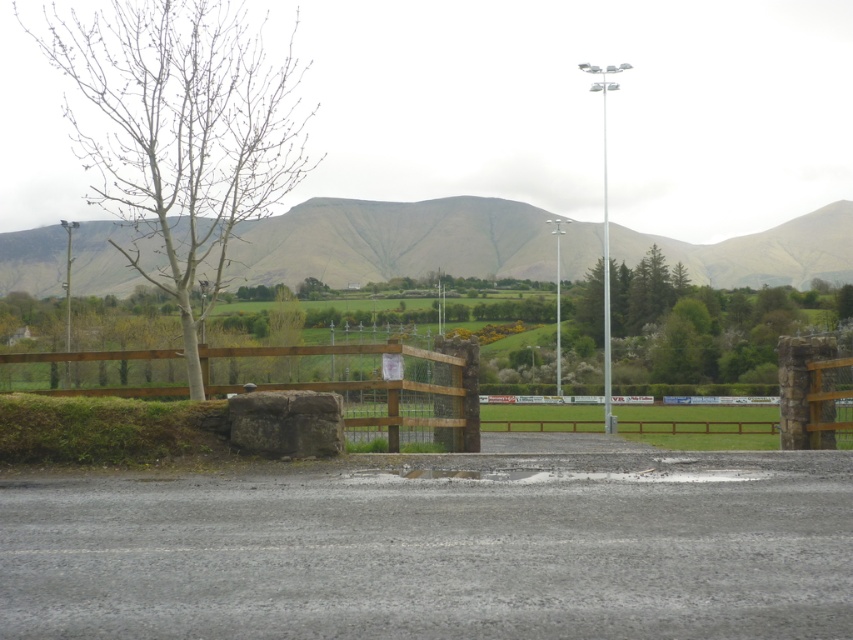
Between bare wood tree at left and green grassy hill at upper center, which one is positioned lower?

Positioned lower is green grassy hill at upper center.

Does bare wood tree at left have a larger size compared to green grassy hill at upper center?

No.

I want to click on bare wood tree at left, so click(178, 134).

Find the location of a particular element. bare wood tree at left is located at coordinates (178, 134).

Is green grassy hill at upper center further to camera compared to brown wooden fence at lower left?

Yes, it is behind brown wooden fence at lower left.

Locate an element on the screen. This screenshot has width=853, height=640. green grassy hill at upper center is located at coordinates (393, 241).

This screenshot has height=640, width=853. Describe the element at coordinates (393, 241) in the screenshot. I see `green grassy hill at upper center` at that location.

Where is `green grassy hill at upper center`? The image size is (853, 640). green grassy hill at upper center is located at coordinates (393, 241).

Based on the photo, is bare wood tree at left bigger than brown wooden fence at lower left?

Yes, bare wood tree at left is bigger than brown wooden fence at lower left.

Between bare wood tree at left and brown wooden fence at lower left, which one is positioned higher?

Positioned higher is bare wood tree at left.

The height and width of the screenshot is (640, 853). I want to click on bare wood tree at left, so click(178, 134).